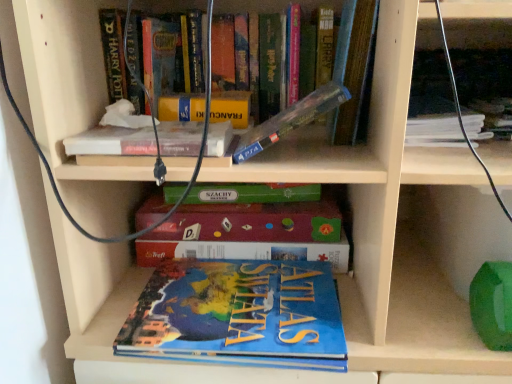
Question: Is clear plastic case at upper center, the fourth book positioned from the bottom, in front of or behind blue matte atlas of the world at lower center, arranged as the 6th book when viewed from the top, in the image?

Choices:
 (A) front
 (B) behind

Answer: (A)

Question: Is clear plastic case at upper center, the fourth book positioned from the bottom, situated inside blue matte atlas of the world at lower center, which is the 1th book from bottom to top, or outside?

Choices:
 (A) inside
 (B) outside

Answer: (B)

Question: Estimate the real-world distances between objects in this image. Which object is farther from the yellow matte book at upper center?

Choices:
 (A) hardcover book at upper center, arranged as the first book when viewed from the top
 (B) clear plastic case at upper center, marked as the third book in a top-to-bottom arrangement
 (C) blue cardboard puzzle at center, arranged as the fifth book when viewed from the top
 (D) blue matte atlas of the world at lower center, arranged as the 6th book when viewed from the top
 (E) hardcover book at upper right, positioned as the fifth book in bottom-to-top order

Answer: (E)

Question: Considering the real-world distances, which object is farthest from the blue matte atlas of the world at lower center, which is the 1th book from bottom to top?

Choices:
 (A) white matte book at upper center, the fourth book when ordered from top to bottom
 (B) hardcover book at upper right, which is the 2th book from top to bottom
 (C) clear plastic case at upper center, the fourth book positioned from the bottom
 (D) blue cardboard puzzle at center, arranged as the fifth book when viewed from the top
 (E) hardcover book at upper center, arranged as the first book when viewed from the top

Answer: (B)